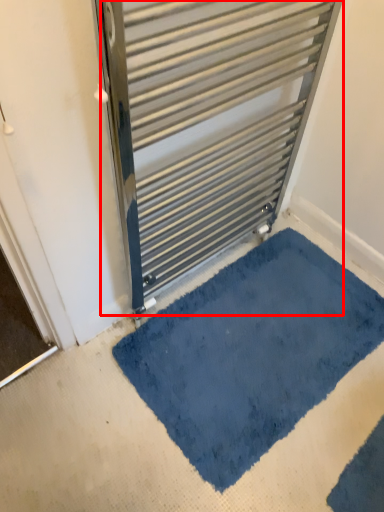
Question: From the image's perspective, what is the correct spatial relationship of radiator (annotated by the red box) in relation to bath mat?

Choices:
 (A) below
 (B) above

Answer: (B)